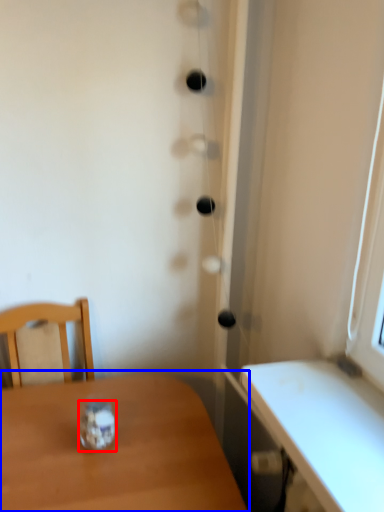
Question: Which point is further to the camera, glass jar (highlighted by a red box) or table (highlighted by a blue box)?

Choices:
 (A) glass jar
 (B) table

Answer: (A)